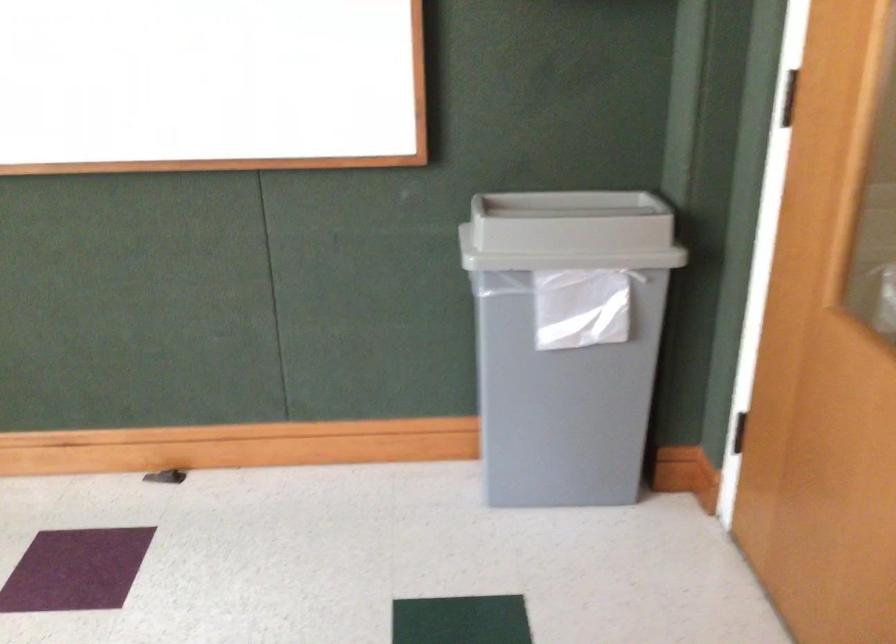
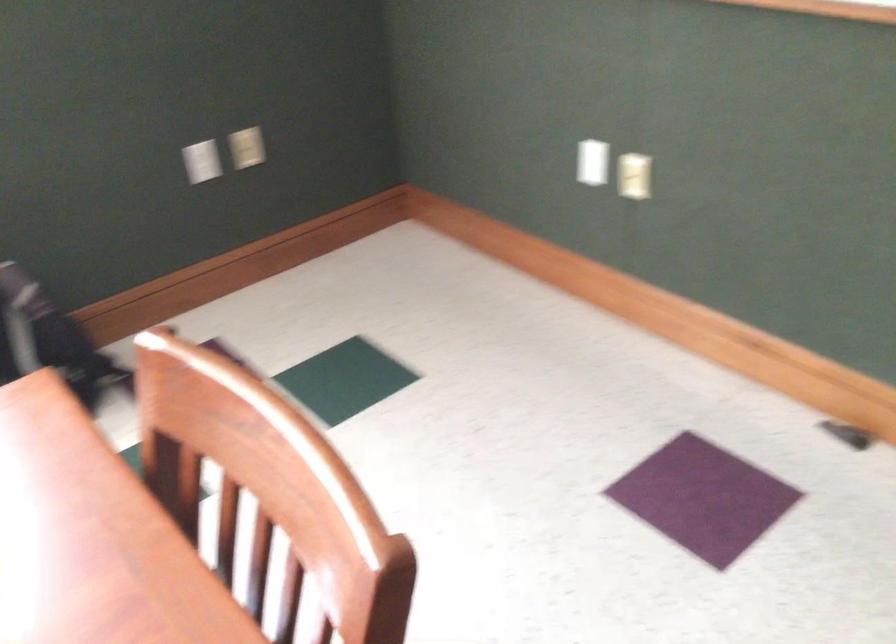
The first image is from the beginning of the video and the second image is from the end. How did the camera likely rotate when shooting the video?

The camera's rotation is toward left-down.